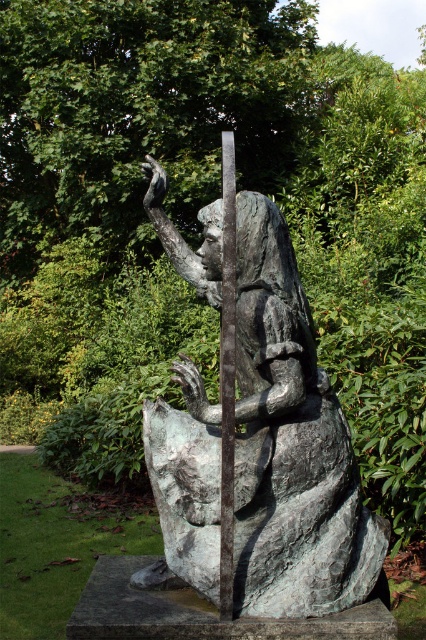
You are a photographer standing 3 meters away from the bronze statue at center. You want to take a closeup shot of the statue without moving closer than 2.5 meters. Can you do it?

The bronze statue at center is 2.62 meters away from the camera. Since you are standing 3 meters away, you are further than the statue. To take a closeup without moving closer than 2.5 meters, you need to be within 2.5 meters. However, you are currently at 3 meters, which is beyond the limit. Therefore, you cannot take the closeup shot under these conditions.

You are standing in front of the bronze sculpture and want to locate the point at coordinates point (290, 445). According to the scene description, where exactly is this point located?

The point (290, 445) is located on the bronze statue at center.

You are standing in front of the bronze sculpture and want to take a photo of both the point at location (330, 528) and the point at (229, 228). Which point will appear closer to the camera in your photo?

Point (229, 228) will appear closer to the camera in the photo because it is physically closer to the viewer than point (330, 528), which is further away.